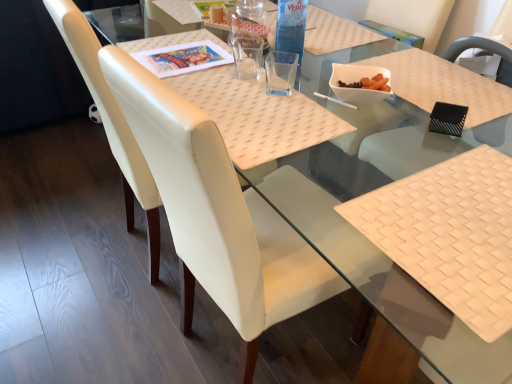
Identify the location of vacant point to the right of white glossy bowl at center. tap(419, 94).